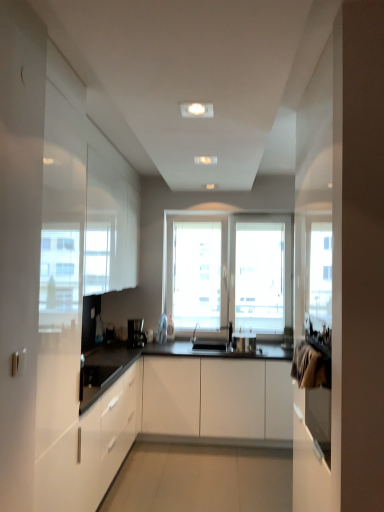
Question: Which direction should I rotate to look at white matte cabinet at center, which appears as the second cabinetry when viewed from the left?

Choices:
 (A) left
 (B) right

Answer: (B)

Question: Can you confirm if metallic silver pot at center is wider than black plastic coffee machine at center?

Choices:
 (A) no
 (B) yes

Answer: (B)

Question: Would you consider metallic silver pot at center to be distant from black plastic coffee machine at center?

Choices:
 (A) yes
 (B) no

Answer: (A)

Question: Is black plastic coffee machine at center inside metallic silver pot at center?

Choices:
 (A) yes
 (B) no

Answer: (B)

Question: From the image's perspective, does metallic silver pot at center appear lower than black plastic coffee machine at center?

Choices:
 (A) yes
 (B) no

Answer: (A)

Question: Considering the relative sizes of metallic silver pot at center and black plastic coffee machine at center in the image provided, is metallic silver pot at center bigger than black plastic coffee machine at center?

Choices:
 (A) yes
 (B) no

Answer: (A)

Question: Is metallic silver pot at center facing towards black plastic coffee machine at center?

Choices:
 (A) yes
 (B) no

Answer: (B)

Question: From the image's perspective, is white matte cabinet at center, acting as the 1th cabinetry starting from the right, over black plastic coffee machine at center?

Choices:
 (A) yes
 (B) no

Answer: (B)

Question: Is white matte cabinet at center, which appears as the second cabinetry when viewed from the left, facing towards black plastic coffee machine at center?

Choices:
 (A) no
 (B) yes

Answer: (A)

Question: Is the surface of white matte cabinet at center, which appears as the second cabinetry when viewed from the left, in direct contact with black plastic coffee machine at center?

Choices:
 (A) yes
 (B) no

Answer: (B)

Question: Does white matte cabinet at center, which appears as the second cabinetry when viewed from the left, come behind black plastic coffee machine at center?

Choices:
 (A) yes
 (B) no

Answer: (B)

Question: From a real-world perspective, is white matte cabinet at center, which appears as the second cabinetry when viewed from the left, on black plastic coffee machine at center?

Choices:
 (A) no
 (B) yes

Answer: (A)

Question: Can you confirm if white matte cabinet at center, acting as the 1th cabinetry starting from the right, is smaller than black plastic coffee machine at center?

Choices:
 (A) yes
 (B) no

Answer: (B)

Question: Considering the relative sizes of white glossy cabinet at left, which is counted as the 1th cabinetry, starting from the left, and white matte cabinet at center, which appears as the second cabinetry when viewed from the left, in the image provided, is white glossy cabinet at left, which is counted as the 1th cabinetry, starting from the left, smaller than white matte cabinet at center, which appears as the second cabinetry when viewed from the left,?

Choices:
 (A) no
 (B) yes

Answer: (A)